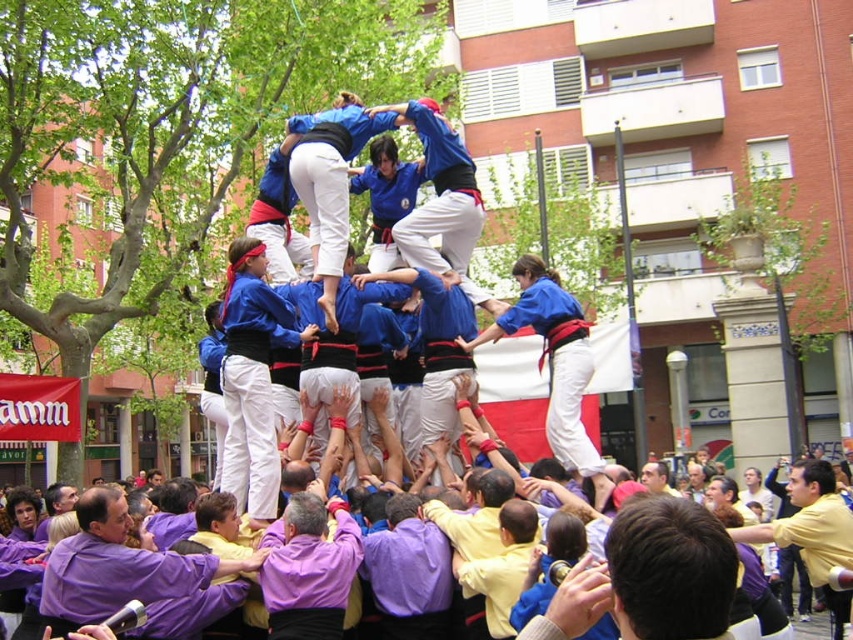
Question: Among these points, which one is nearest to the camera?

Choices:
 (A) (335, 538)
 (B) (418, 579)
 (C) (651, 468)

Answer: (B)

Question: Does purple cotton shirt at lower left lie behind purple cotton shirt at center?

Choices:
 (A) no
 (B) yes

Answer: (A)

Question: Which object is closer to the camera taking this photo?

Choices:
 (A) purple cotton shirt at lower center
 (B) yellow matte shirt at center
 (C) smooth yellow shirt at center
 (D) purple cotton shirt at lower left

Answer: (D)

Question: Can you confirm if purple cotton shirt at center is positioned above smooth yellow shirt at center?

Choices:
 (A) no
 (B) yes

Answer: (B)

Question: Where is purple cotton shirt at lower center located in relation to yellow matte shirt at center in the image?

Choices:
 (A) above
 (B) below

Answer: (A)

Question: Which point is farther from the camera taking this photo?

Choices:
 (A) (744, 525)
 (B) (666, 488)

Answer: (B)